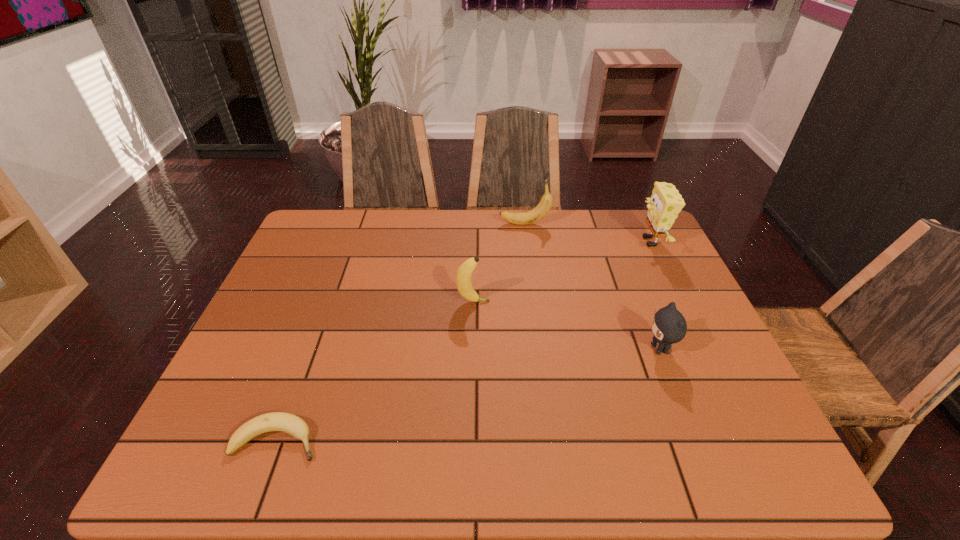
Image resolution: width=960 pixels, height=540 pixels. Identify the location of sponge. (665, 203).

Locate an element on the screen. the third object from left to right is located at coordinates (525, 218).

You are a GUI agent. You are given a task and a screenshot of the screen. Output one action in this format:
    pyautogui.click(x=<x>, y=<y>)
    Task: Click on the farthest banana
    
    Given the screenshot: What is the action you would take?
    pyautogui.click(x=525, y=218)

I want to click on the second object from left to right, so click(x=463, y=278).

This screenshot has width=960, height=540. What are the coordinates of `the third nearest object` in the screenshot? It's located at (463, 278).

Locate an element on the screen. This screenshot has width=960, height=540. kitten is located at coordinates (669, 326).

You are a GUI agent. You are given a task and a screenshot of the screen. Output one action in this format:
    pyautogui.click(x=<x>, y=<y>)
    Task: Click on the second object from right to left
    The image size is (960, 540).
    Given the screenshot: What is the action you would take?
    pyautogui.click(x=669, y=326)

Where is `the leftmost object`? The height and width of the screenshot is (540, 960). the leftmost object is located at coordinates (276, 421).

You are a GUI agent. You are given a task and a screenshot of the screen. Output one action in this format:
    pyautogui.click(x=<x>, y=<y>)
    Task: Click on the leftmost banana
    Image resolution: width=960 pixels, height=540 pixels.
    Given the screenshot: What is the action you would take?
    pyautogui.click(x=276, y=421)

This screenshot has height=540, width=960. In order to click on blank space located 0.270m on the face of the rightmost object in this screenshot , I will do `click(551, 241)`.